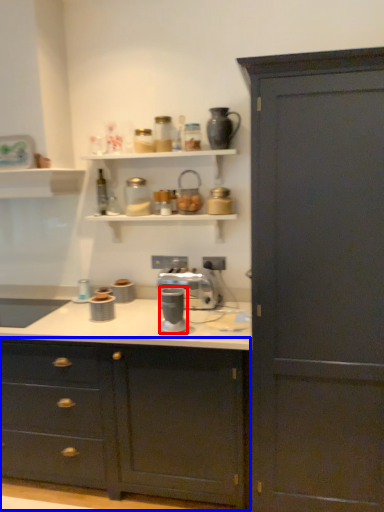
Question: Which object is closer to the camera taking this photo, coffee machine (highlighted by a red box) or cabinetry (highlighted by a blue box)?

Choices:
 (A) coffee machine
 (B) cabinetry

Answer: (B)